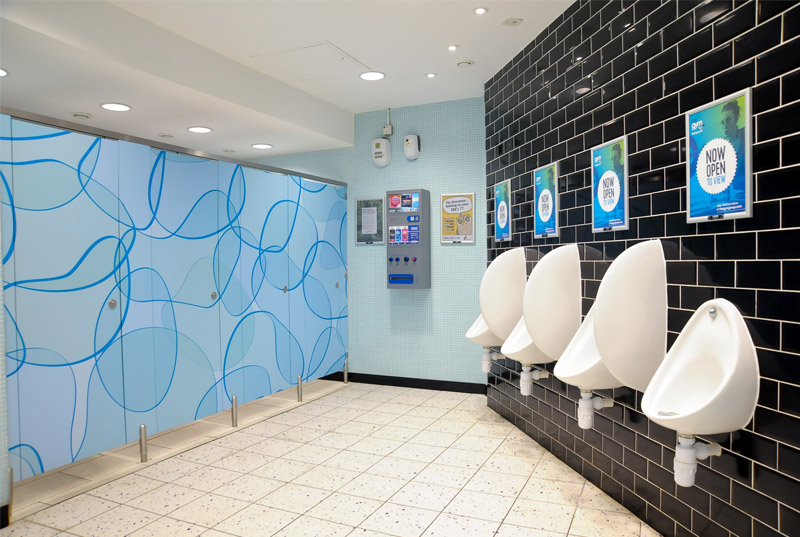
Image resolution: width=800 pixels, height=537 pixels. I want to click on dividers, so click(x=638, y=309), click(x=556, y=293), click(x=501, y=290).